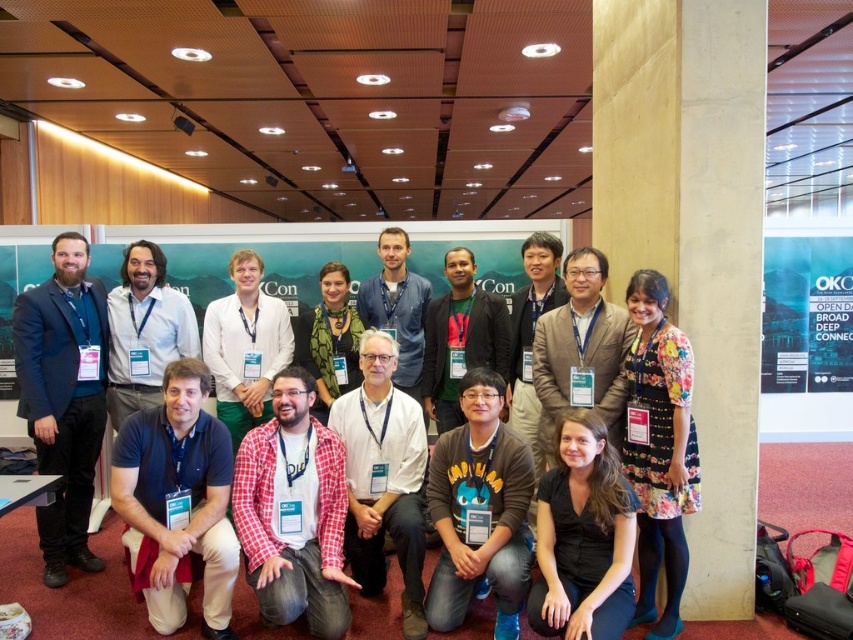
Who is lower down, matte white shirt at center or matte blue shirt at center?

matte white shirt at center

Locate an element on the screen. This screenshot has height=640, width=853. matte white shirt at center is located at coordinates [144, 332].

Who is more forward, [62,451] or [614,460]?

Point [614,460] is more forward.

The width and height of the screenshot is (853, 640). Describe the element at coordinates (62, 397) in the screenshot. I see `dark blue suit at left` at that location.

Is point (93, 349) farther from viewer compared to point (624, 554)?

Yes, it is behind point (624, 554).

I want to click on dark blue suit at left, so click(x=62, y=397).

Who is positioned more to the right, green fabric banner at upper center or green fabric shirt at center?

From the viewer's perspective, green fabric shirt at center appears more on the right side.

Between green fabric banner at upper center and green fabric shirt at center, which one is positioned higher?

green fabric banner at upper center is higher up.

The height and width of the screenshot is (640, 853). In order to click on green fabric banner at upper center in this screenshot , I will do `click(244, 248)`.